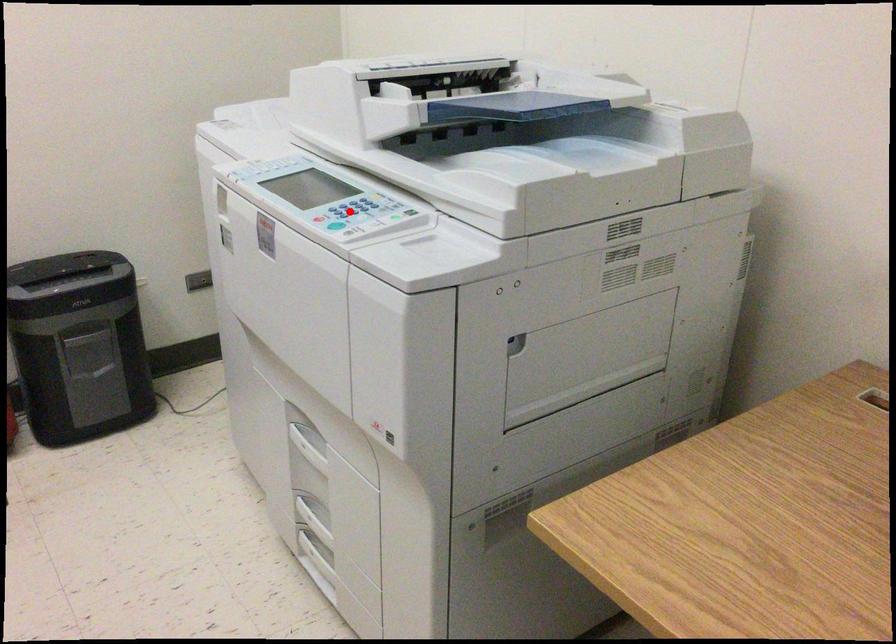
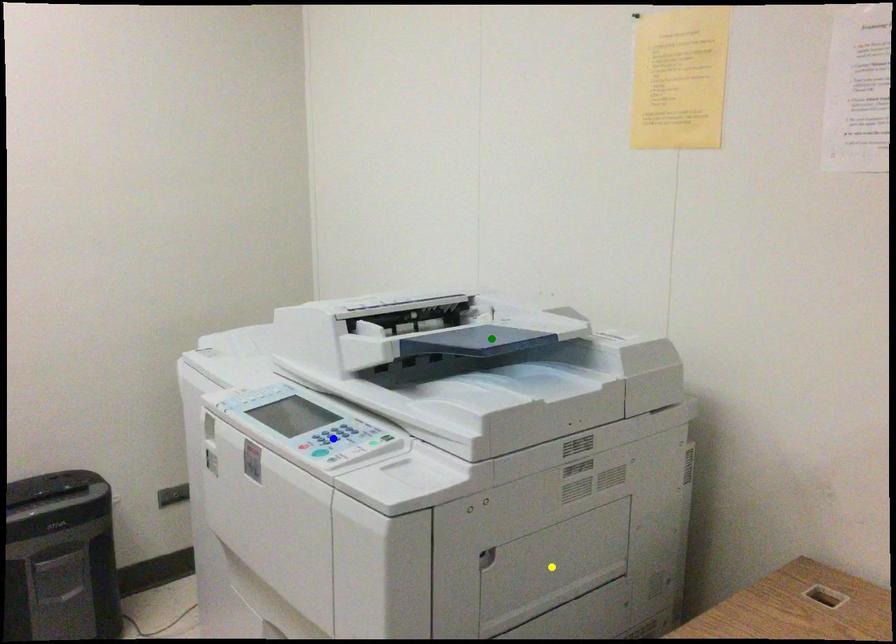
Question: I am providing you with two images of the same scene from different viewpoints. A red point is marked on the first image. You are given multiple points on the second image. Can you choose the point in image 2 that corresponds to the point in image 1?

Choices:
 (A) yellow point
 (B) green point
 (C) blue point

Answer: (C)